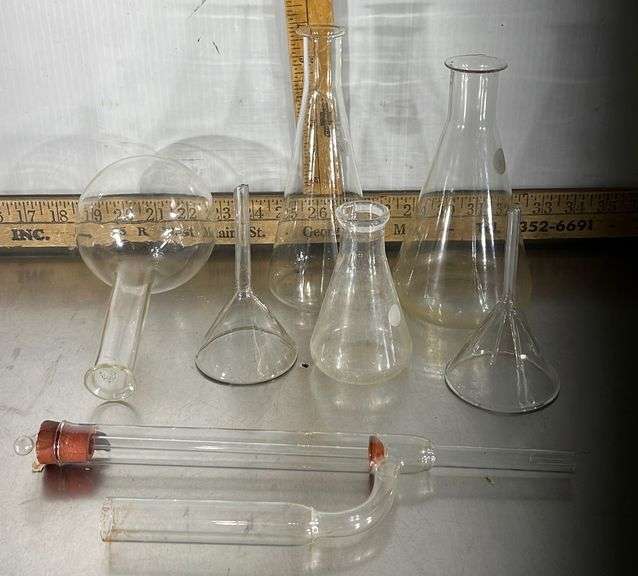
This screenshot has height=576, width=638. In order to click on flask in this screenshot , I will do `click(446, 302)`.